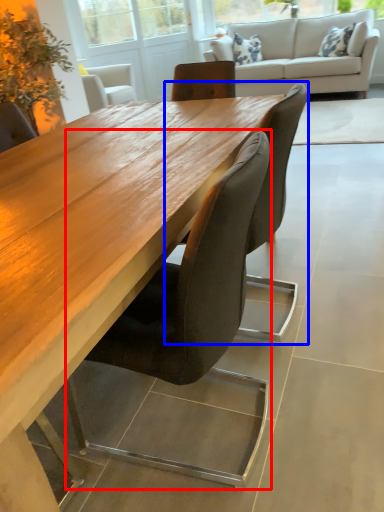
Question: Among these objects, which one is nearest to the camera, chair (highlighted by a red box) or chair (highlighted by a blue box)?

Choices:
 (A) chair
 (B) chair

Answer: (A)